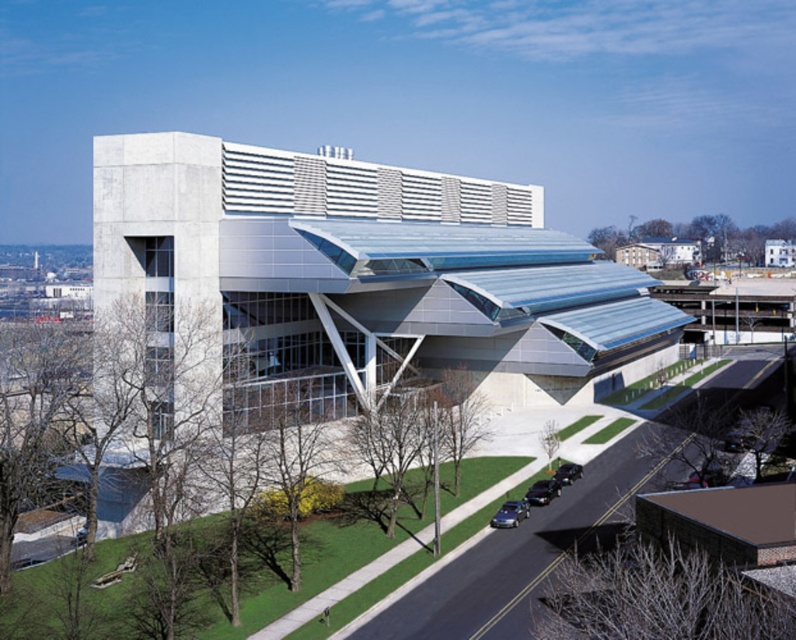
You are standing next to the shiny blue sedan at lower center and want to take a photo of the modern architectural structure. If your camera can capture objects up to 50 meters away, will you be able to take a clear photo of the building?

The shiny blue sedan at lower center and camera are 56.83 meters apart from each other. Since the camera can only capture objects up to 50 meters away, you will not be able to take a clear photo of the modern architectural structure from this position.

You are standing at the entrance of the modern architectural structure and want to park your car in the closest available spot. The shiny blue sedan at lower center is parked somewhere in the area. Based on its coordinates, can you determine if it is positioned to the left or right side of the entrance?

The shiny blue sedan at lower center is located at coordinates point (x=510, y=513). Since the x coordinate 0.803 is closer to the right side of the image, the shiny blue sedan at lower center is positioned to the right side of the entrance.

You are standing in front of the modern architectural structure and see a point marked at coordinates (x=510, y=513). What object is located at this point?

The point at coordinates (x=510, y=513) indicates the location of the shiny blue sedan at lower center.